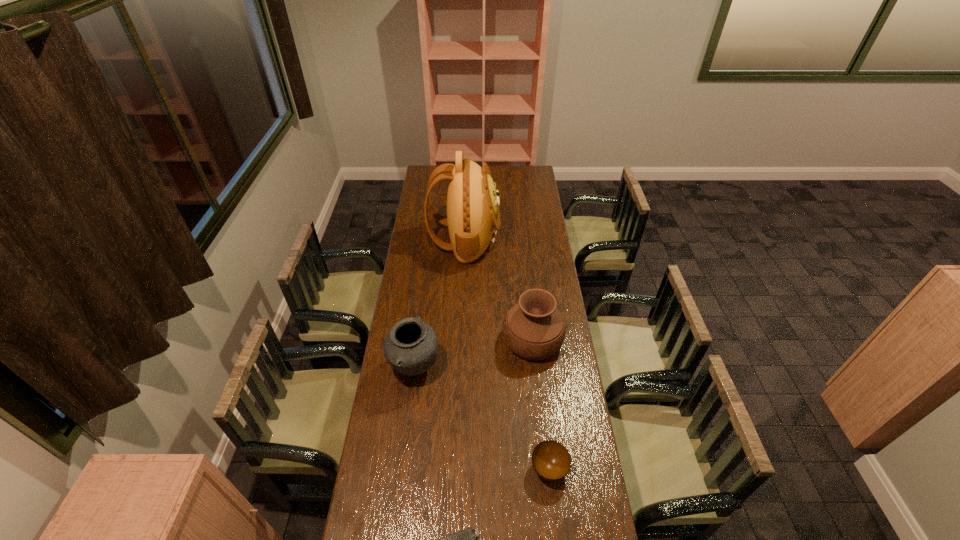
The height and width of the screenshot is (540, 960). I want to click on backpack, so click(x=473, y=217).

Find the location of a particular element. the tallest object is located at coordinates (473, 217).

Locate an element on the screen. The height and width of the screenshot is (540, 960). the right urn is located at coordinates (534, 329).

The width and height of the screenshot is (960, 540). Identify the location of the left urn. (411, 346).

Locate an element on the screen. the fourth farthest object is located at coordinates pyautogui.click(x=551, y=460).

In order to click on the fourth tallest object in this screenshot , I will do `click(551, 460)`.

Where is `blank space located on the front-facing side of the backpack`? This screenshot has height=540, width=960. blank space located on the front-facing side of the backpack is located at coordinates (524, 240).

Identify the location of free space located on the left of the right urn. Image resolution: width=960 pixels, height=540 pixels. (414, 340).

Locate an element on the screen. Image resolution: width=960 pixels, height=540 pixels. vacant area situated on the right of the left urn is located at coordinates (496, 368).

Where is `blank space located 0.360m on the left of the bowl`? This screenshot has width=960, height=540. blank space located 0.360m on the left of the bowl is located at coordinates (421, 469).